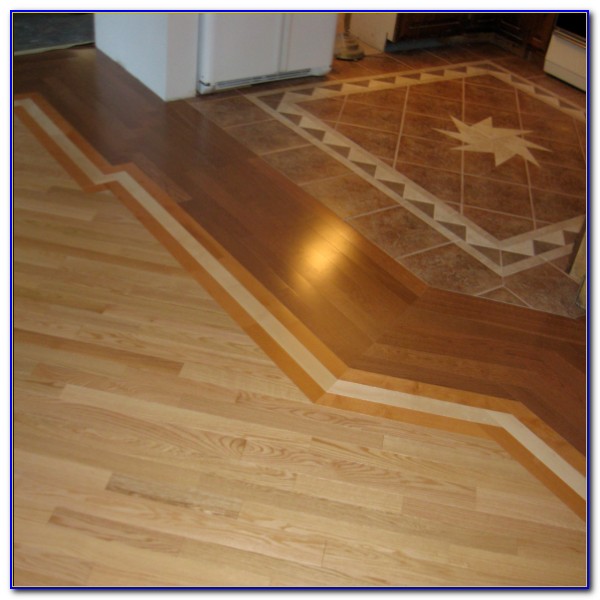
Find the location of a particular element. The height and width of the screenshot is (600, 600). threshold is located at coordinates (43, 54).